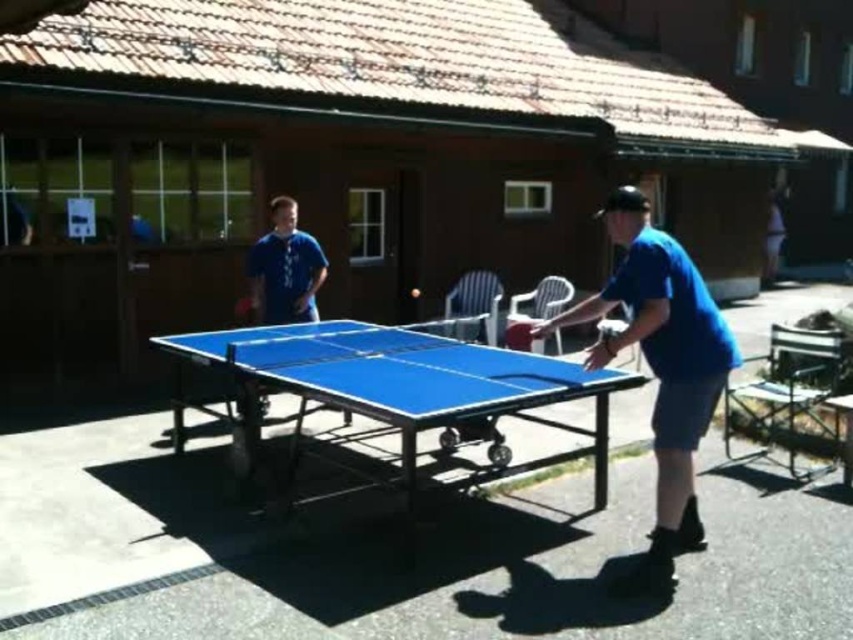
Question: Observing the image, what is the correct spatial positioning of blue plastic table at center in reference to blue fabric shorts at lower right?

Choices:
 (A) above
 (B) below

Answer: (B)

Question: Considering the real-world distances, which object is farthest from the blue matte shirt at center?

Choices:
 (A) blue plastic table at center
 (B) blue fabric shorts at lower right
 (C) blue matte shirt at upper left

Answer: (B)

Question: Is blue plastic table at center bigger than blue matte shirt at upper left?

Choices:
 (A) no
 (B) yes

Answer: (B)

Question: Based on their relative distances, which object is farther from the blue matte shirt at center?

Choices:
 (A) blue fabric shorts at lower right
 (B) blue matte shirt at upper left

Answer: (A)

Question: In this image, where is blue matte shirt at center located relative to blue matte shirt at upper left?

Choices:
 (A) left
 (B) right

Answer: (B)

Question: Which point is closer to the camera taking this photo?

Choices:
 (A) (648, 339)
 (B) (776, 259)

Answer: (A)